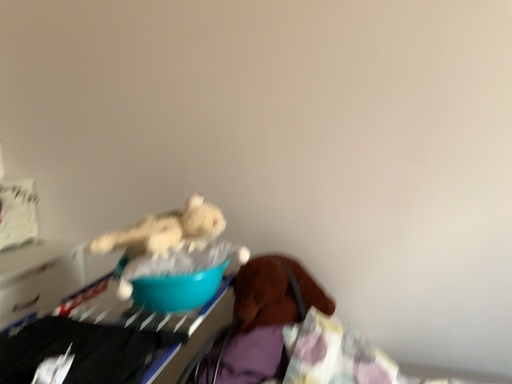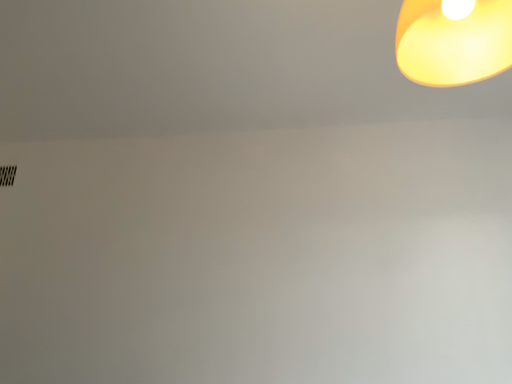
Question: Which way did the camera rotate in the video?

Choices:
 (A) rotated downward
 (B) rotated upward

Answer: (B)